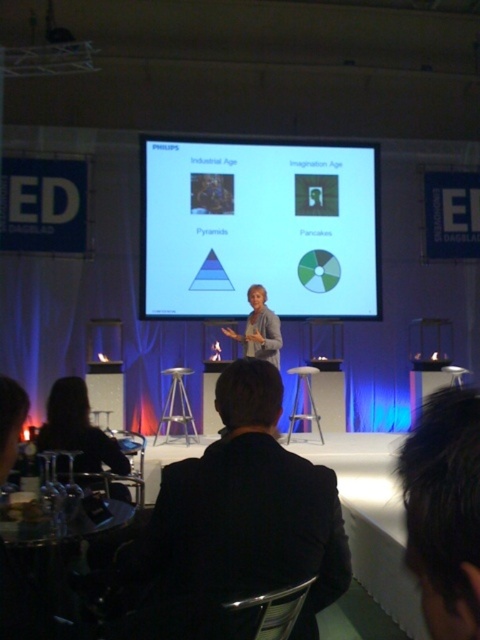
You are an attendee at the presentation and want to sit on the silver metallic stool at center. However, you notice the light beige blazer at center is currently covering the stool. Can you estimate if the stool is wider than the blazer to sit on it?

The light beige blazer at center is wider than the silver metallic stool at center, so the blazer covers the stool completely. Therefore, the stool is not wider than the blazer, making it difficult to sit on it without moving the blazer first.